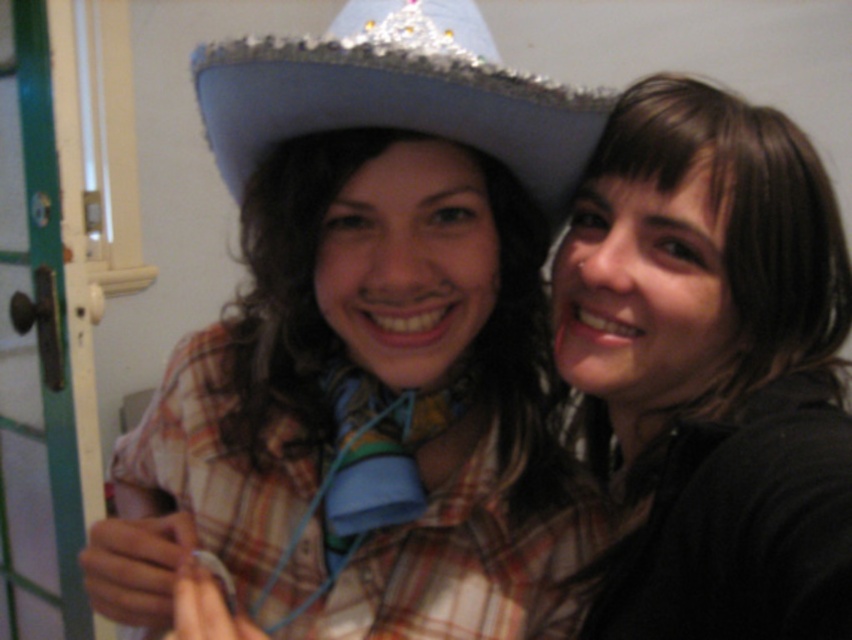
Measure the distance between point (x=689, y=230) and camera.

Point (x=689, y=230) is 24.22 inches away from camera.

Is brown matte hair at upper right positioned at the back of shiny silver sombrero at upper center?

No, brown matte hair at upper right is in front of shiny silver sombrero at upper center.

Describe the element at coordinates (711, 369) in the screenshot. I see `brown matte hair at upper right` at that location.

Identify the location of brown matte hair at upper right. (711, 369).

Is point (436, 209) closer to camera compared to point (250, 99)?

No, (436, 209) is behind (250, 99).

Who is positioned more to the left, matte blue hat at center or shiny silver sombrero at upper center?

matte blue hat at center

Is point (377, 595) more distant than point (433, 51)?

Yes, point (377, 595) is behind point (433, 51).

Where is `matte blue hat at center`? The width and height of the screenshot is (852, 640). matte blue hat at center is located at coordinates (378, 316).

Does matte blue hat at center appear under brown matte hair at upper right?

Correct, matte blue hat at center is located below brown matte hair at upper right.

The width and height of the screenshot is (852, 640). I want to click on matte blue hat at center, so click(x=378, y=316).

Is point (366, 609) more distant than point (622, 516)?

No, it is in front of (622, 516).

At what (x,y) coordinates should I click in order to perform the action: click on matte blue hat at center. Please return your answer as a coordinate pair (x, y). The image size is (852, 640). Looking at the image, I should click on (378, 316).